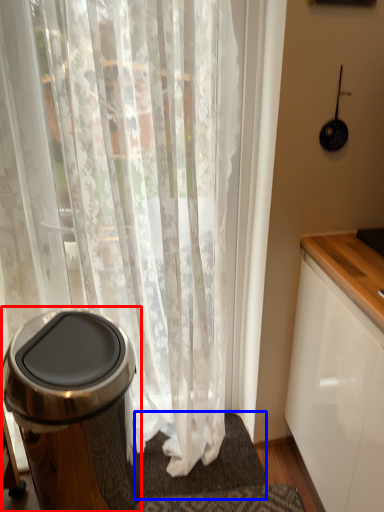
Question: Which object is closer to the camera taking this photo, waste container (highlighted by a red box) or bath mat (highlighted by a blue box)?

Choices:
 (A) waste container
 (B) bath mat

Answer: (A)